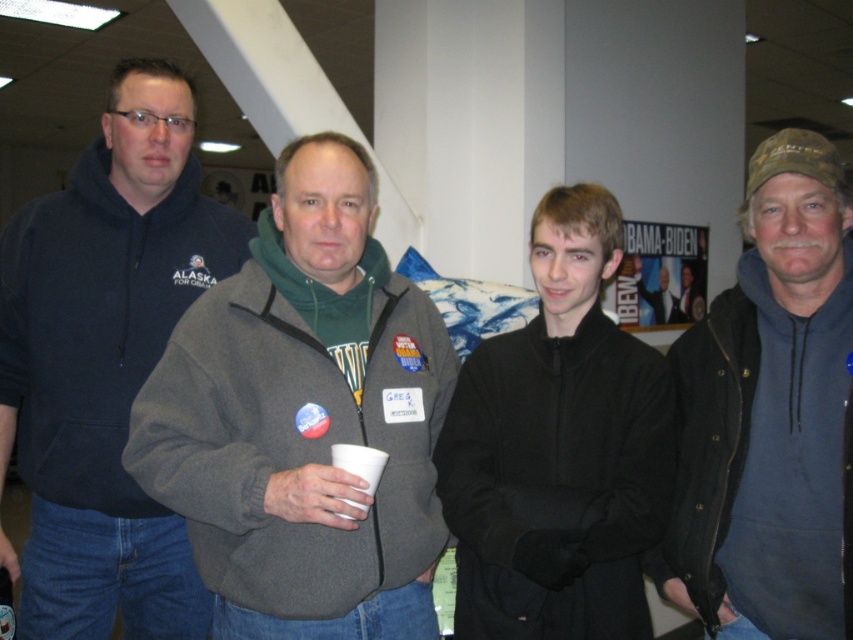
Can you confirm if blue fleece jacket at right is smaller than black fleece jacket at center?

No.

Is blue fleece jacket at right further to camera compared to black fleece jacket at center?

Yes, blue fleece jacket at right is behind black fleece jacket at center.

The width and height of the screenshot is (853, 640). Find the location of `blue fleece jacket at right`. blue fleece jacket at right is located at coordinates (770, 413).

Can you confirm if dark blue fleece at left is bigger than blue fleece jacket at right?

Yes, dark blue fleece at left is bigger than blue fleece jacket at right.

Is point (148, 65) closer to camera compared to point (850, 400)?

No.

Does point (64, 451) come farther from viewer compared to point (763, 605)?

Yes.

Where is `dark blue fleece at left`? Image resolution: width=853 pixels, height=640 pixels. dark blue fleece at left is located at coordinates (105, 364).

Is gray fleece jacket at center below blue fleece jacket at right?

Actually, gray fleece jacket at center is above blue fleece jacket at right.

Based on the photo, between gray fleece jacket at center and blue fleece jacket at right, which one has more height?

Standing taller between the two is blue fleece jacket at right.

Where is `gray fleece jacket at center`? The height and width of the screenshot is (640, 853). gray fleece jacket at center is located at coordinates (305, 419).